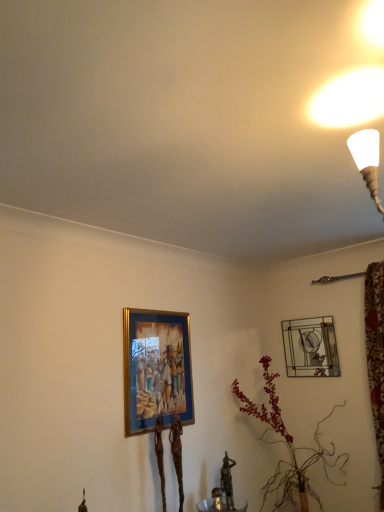
Identify the location of metallic glass picture frame at upper right, the first picture frame positioned from the right. The width and height of the screenshot is (384, 512). (310, 347).

The image size is (384, 512). What do you see at coordinates (310, 347) in the screenshot?
I see `metallic glass picture frame at upper right, the first picture frame positioned from the right` at bounding box center [310, 347].

At what (x,y) coordinates should I click in order to perform the action: click on leather-like plant at center-right. Please return your answer as a coordinate pair (x, y). Looking at the image, I should click on (287, 445).

The height and width of the screenshot is (512, 384). Find the location of `gold-framed painting at lower left, which is the first picture frame in left-to-right order`. gold-framed painting at lower left, which is the first picture frame in left-to-right order is located at coordinates (156, 369).

You are a GUI agent. You are given a task and a screenshot of the screen. Output one action in this format:
    pyautogui.click(x=<x>, y=<y>)
    Task: Click on the metallic glass picture frame at upper right, acting as the second picture frame starting from the left
    Image resolution: width=384 pixels, height=512 pixels.
    Given the screenshot: What is the action you would take?
    pyautogui.click(x=310, y=347)

Is gold-framed painting at lower left, which is the first picture frame in left-to-right order, inside or outside of leather-like plant at center-right?

gold-framed painting at lower left, which is the first picture frame in left-to-right order, is located beyond the bounds of leather-like plant at center-right.

In the image, there is a gold-framed painting at lower left, which is the first picture frame in left-to-right order. Find the location of `houseplant below it (from the image's perspective)`. houseplant below it (from the image's perspective) is located at coordinates (287, 445).

Does gold-framed painting at lower left, the 2th picture frame in the right-to-left sequence, have a greater width compared to leather-like plant at center-right?

No, gold-framed painting at lower left, the 2th picture frame in the right-to-left sequence, is not wider than leather-like plant at center-right.

Is point (163, 321) closer to camera compared to point (293, 502)?

Yes, point (163, 321) is closer to viewer.

Which object is more forward, leather-like plant at center-right or gold-framed painting at lower left, the 2th picture frame in the right-to-left sequence?

gold-framed painting at lower left, the 2th picture frame in the right-to-left sequence, is more forward.

What's the angular difference between leather-like plant at center-right and gold-framed painting at lower left, which is the first picture frame in left-to-right order,'s facing directions?

leather-like plant at center-right and gold-framed painting at lower left, which is the first picture frame in left-to-right order, are facing 0.146 degrees away from each other.

Considering the relative positions of leather-like plant at center-right and gold-framed painting at lower left, the 2th picture frame in the right-to-left sequence, in the image provided, is leather-like plant at center-right to the left or to the right of gold-framed painting at lower left, the 2th picture frame in the right-to-left sequence,?

leather-like plant at center-right is positioned on gold-framed painting at lower left, the 2th picture frame in the right-to-left sequence,'s right side.

Is leather-like plant at center-right wider than gold-framed painting at lower left, which is the first picture frame in left-to-right order?

Indeed, leather-like plant at center-right has a greater width compared to gold-framed painting at lower left, which is the first picture frame in left-to-right order.

At what (x,y) coordinates should I click in order to perform the action: click on picture frame below the metallic glass picture frame at upper right, which is counted as the 1th picture frame, starting from the back (from a real-world perspective). Please return your answer as a coordinate pair (x, y). The width and height of the screenshot is (384, 512). Looking at the image, I should click on (156, 369).

From a real-world perspective, which object rests below the other?

gold-framed painting at lower left, the 2th picture frame in the right-to-left sequence, is physically lower.

Which object is closer to the camera, metallic glass picture frame at upper right, the 2th picture frame when ordered from front to back, or gold-framed painting at lower left, the first picture frame from the front?

gold-framed painting at lower left, the first picture frame from the front.

From the image's perspective, is gold-framed painting at lower left, the first picture frame from the front, positioned above or below metallic glass picture frame at upper right, the 2th picture frame when ordered from front to back?

gold-framed painting at lower left, the first picture frame from the front, is above metallic glass picture frame at upper right, the 2th picture frame when ordered from front to back.

At what (x,y) coordinates should I click in order to perform the action: click on picture frame below the gold-framed painting at lower left, which is the first picture frame in left-to-right order (from the image's perspective). Please return your answer as a coordinate pair (x, y). Looking at the image, I should click on (310, 347).

Is gold-framed painting at lower left, which is the first picture frame in left-to-right order, aimed at metallic glass picture frame at upper right, the first picture frame positioned from the right?

No, gold-framed painting at lower left, which is the first picture frame in left-to-right order, is not oriented towards metallic glass picture frame at upper right, the first picture frame positioned from the right.

Measure the distance from gold-framed painting at lower left, the 2th picture frame in the right-to-left sequence, to metallic glass picture frame at upper right, which is counted as the 1th picture frame, starting from the back.

The distance of gold-framed painting at lower left, the 2th picture frame in the right-to-left sequence, from metallic glass picture frame at upper right, which is counted as the 1th picture frame, starting from the back, is 4.13 feet.

Is leather-like plant at center-right at the back of metallic glass picture frame at upper right, acting as the second picture frame starting from the left?

No, metallic glass picture frame at upper right, acting as the second picture frame starting from the left,'s orientation is not away from leather-like plant at center-right.

How different are the orientations of metallic glass picture frame at upper right, the first picture frame positioned from the right, and leather-like plant at center-right in degrees?

They differ by 91 degrees in their facing directions.

Are metallic glass picture frame at upper right, acting as the second picture frame starting from the left, and leather-like plant at center-right making contact?

metallic glass picture frame at upper right, acting as the second picture frame starting from the left, and leather-like plant at center-right are not in contact.

Which object is closer to the camera taking this photo, leather-like plant at center-right or metallic glass picture frame at upper right, the 2th picture frame when ordered from front to back?

Positioned in front is leather-like plant at center-right.

Is leather-like plant at center-right touching metallic glass picture frame at upper right, the 2th picture frame when ordered from front to back?

leather-like plant at center-right and metallic glass picture frame at upper right, the 2th picture frame when ordered from front to back, are clearly separated.

Is leather-like plant at center-right looking in the opposite direction of metallic glass picture frame at upper right, which is counted as the 1th picture frame, starting from the back?

That's not correct — leather-like plant at center-right is not looking away from metallic glass picture frame at upper right, which is counted as the 1th picture frame, starting from the back.

Which is in front, point (330, 480) or point (323, 325)?

The point (330, 480) is more forward.

In order to click on houseplant located below the gold-framed painting at lower left, the 2th picture frame in the right-to-left sequence (from the image's perspective) in this screenshot , I will do `click(287, 445)`.

This screenshot has height=512, width=384. I want to click on houseplant lying behind the gold-framed painting at lower left, the first picture frame from the front, so click(287, 445).

When comparing their distances from gold-framed painting at lower left, which appears as the 2th picture frame when viewed from the back, does leather-like plant at center-right or metallic glass picture frame at upper right, the first picture frame positioned from the right, seem closer?

leather-like plant at center-right.

Looking at the image, which one is located further to metallic glass picture frame at upper right, the 2th picture frame when ordered from front to back, gold-framed painting at lower left, the 2th picture frame in the right-to-left sequence, or leather-like plant at center-right?

gold-framed painting at lower left, the 2th picture frame in the right-to-left sequence.

Looking at the image, which one is located further to gold-framed painting at lower left, which appears as the 2th picture frame when viewed from the back, metallic glass picture frame at upper right, which is counted as the 1th picture frame, starting from the back, or leather-like plant at center-right?

Based on the image, metallic glass picture frame at upper right, which is counted as the 1th picture frame, starting from the back, appears to be further to gold-framed painting at lower left, which appears as the 2th picture frame when viewed from the back.

From the picture: Looking at the image, which one is located closer to metallic glass picture frame at upper right, the 2th picture frame when ordered from front to back, leather-like plant at center-right or gold-framed painting at lower left, the first picture frame from the front?

leather-like plant at center-right is positioned closer to the anchor metallic glass picture frame at upper right, the 2th picture frame when ordered from front to back.

When comparing their distances from leather-like plant at center-right, does metallic glass picture frame at upper right, acting as the second picture frame starting from the left, or gold-framed painting at lower left, the 2th picture frame in the right-to-left sequence, seem closer?

Among the two, metallic glass picture frame at upper right, acting as the second picture frame starting from the left, is located nearer to leather-like plant at center-right.

From the image, which object appears to be nearer to leather-like plant at center-right, gold-framed painting at lower left, which appears as the 2th picture frame when viewed from the back, or metallic glass picture frame at upper right, acting as the second picture frame starting from the left?

metallic glass picture frame at upper right, acting as the second picture frame starting from the left, is positioned closer to the anchor leather-like plant at center-right.

You are a GUI agent. You are given a task and a screenshot of the screen. Output one action in this format:
    pyautogui.click(x=<x>, y=<y>)
    Task: Click on the houseplant located between gold-framed painting at lower left, which appears as the 2th picture frame when viewed from the back, and metallic glass picture frame at upper right, the first picture frame positioned from the right, in the left-right direction
    This screenshot has width=384, height=512.
    Given the screenshot: What is the action you would take?
    pyautogui.click(x=287, y=445)